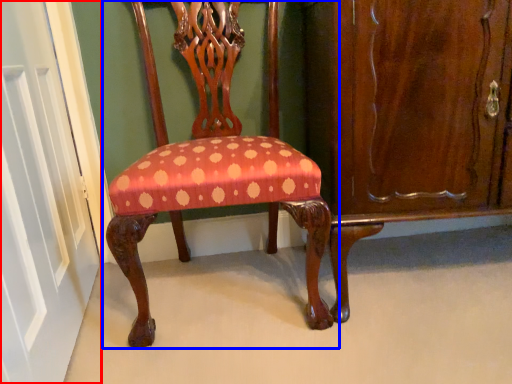
Question: Which point is further to the camera, door (highlighted by a red box) or chair (highlighted by a blue box)?

Choices:
 (A) door
 (B) chair

Answer: (B)